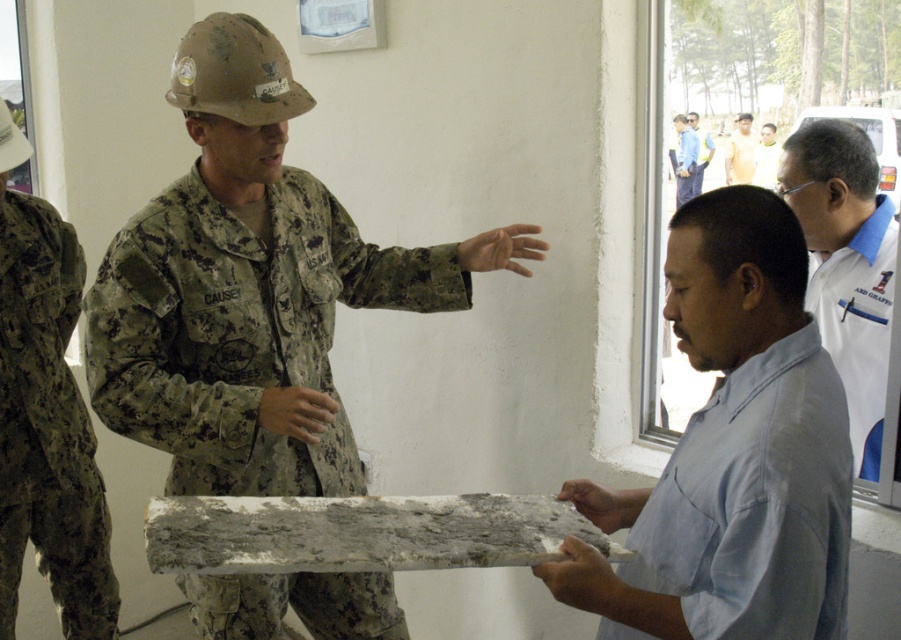
Question: Can you confirm if light brown skin at center is bigger than light blue shirt at center?

Choices:
 (A) no
 (B) yes

Answer: (B)

Question: Is camouflage fabric uniform at center to the left of camouflage fabric uniform at left from the viewer's perspective?

Choices:
 (A) no
 (B) yes

Answer: (A)

Question: Which point is farther from the camera taking this photo?

Choices:
 (A) (672, 164)
 (B) (853, 451)

Answer: (A)

Question: Estimate the real-world distances between objects in this image. Which object is farther from the matte gray concrete slab at center?

Choices:
 (A) blue shirt at upper right
 (B) camouflage fabric uniform at center
 (C) white matte shirt at upper right
 (D) camouflage fabric uniform at left

Answer: (A)

Question: Based on their relative distances, which object is farther from the blue shirt at upper right?

Choices:
 (A) white shirt at right
 (B) camouflage fabric uniform at center
 (C) light blue shirt at center
 (D) camouflage fabric uniform at left

Answer: (D)

Question: Is white shirt at right behind light brown skin at center?

Choices:
 (A) no
 (B) yes

Answer: (A)